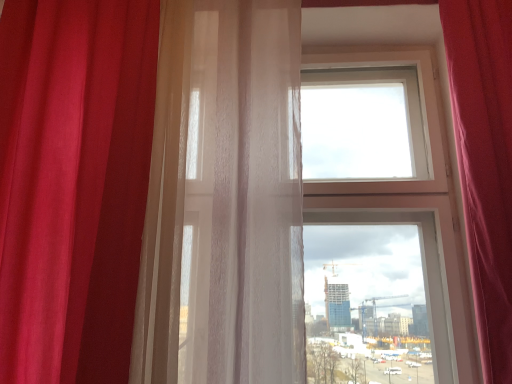
This screenshot has height=384, width=512. What do you see at coordinates (485, 163) in the screenshot? I see `velvet red curtain at right, the third curtain in the left-to-right sequence` at bounding box center [485, 163].

The height and width of the screenshot is (384, 512). I want to click on satin red curtain at left, marked as the first curtain in a left-to-right arrangement, so click(73, 184).

Image resolution: width=512 pixels, height=384 pixels. I want to click on translucent white curtain at left, which ranks as the second curtain in right-to-left order, so click(225, 197).

Locate an element on the screen. The width and height of the screenshot is (512, 384). velvet red curtain at right, which is counted as the first curtain, starting from the right is located at coordinates (485, 163).

From the image's perspective, is satin red curtain at left, which ranks as the 3th curtain in right-to-left order, on top of velvet red curtain at right, which is counted as the first curtain, starting from the right?

Yes, from the image's perspective, satin red curtain at left, which ranks as the 3th curtain in right-to-left order, is on top of velvet red curtain at right, which is counted as the first curtain, starting from the right.

Which is more to the right, satin red curtain at left, marked as the first curtain in a left-to-right arrangement, or velvet red curtain at right, which is counted as the first curtain, starting from the right?

A: From the viewer's perspective, velvet red curtain at right, which is counted as the first curtain, starting from the right, appears more on the right side.

Is point (118, 315) less distant than point (484, 239)?

Yes, point (118, 315) is in front of point (484, 239).

Can you confirm if satin red curtain at left, which ranks as the 3th curtain in right-to-left order, is shorter than velvet red curtain at right, which is counted as the first curtain, starting from the right?

In fact, satin red curtain at left, which ranks as the 3th curtain in right-to-left order, may be taller than velvet red curtain at right, which is counted as the first curtain, starting from the right.

Is translucent white curtain at left, which ranks as the second curtain in right-to-left order, inside or outside of velvet red curtain at right, the third curtain in the left-to-right sequence?

translucent white curtain at left, which ranks as the second curtain in right-to-left order, is not enclosed by velvet red curtain at right, the third curtain in the left-to-right sequence.

Is translucent white curtain at left, which ranks as the second curtain in right-to-left order, facing towards velvet red curtain at right, which is counted as the first curtain, starting from the right?

No, translucent white curtain at left, which ranks as the second curtain in right-to-left order, does not turn towards velvet red curtain at right, which is counted as the first curtain, starting from the right.

Considering the relative sizes of translucent white curtain at left, which ranks as the second curtain in left-to-right order, and velvet red curtain at right, which is counted as the first curtain, starting from the right, in the image provided, is translucent white curtain at left, which ranks as the second curtain in left-to-right order, smaller than velvet red curtain at right, which is counted as the first curtain, starting from the right,?

No.

Which is correct: translucent white curtain at left, which ranks as the second curtain in right-to-left order, is inside satin red curtain at left, which ranks as the 3th curtain in right-to-left order, or outside of it?

translucent white curtain at left, which ranks as the second curtain in right-to-left order, is outside satin red curtain at left, which ranks as the 3th curtain in right-to-left order.

Is translucent white curtain at left, which ranks as the second curtain in right-to-left order, touching satin red curtain at left, which ranks as the 3th curtain in right-to-left order?

No, translucent white curtain at left, which ranks as the second curtain in right-to-left order, is not beside satin red curtain at left, which ranks as the 3th curtain in right-to-left order.

Looking at their sizes, would you say translucent white curtain at left, which ranks as the second curtain in left-to-right order, is wider or thinner than satin red curtain at left, which ranks as the 3th curtain in right-to-left order?

Clearly, translucent white curtain at left, which ranks as the second curtain in left-to-right order, has less width compared to satin red curtain at left, which ranks as the 3th curtain in right-to-left order.

Does translucent white curtain at left, which ranks as the second curtain in left-to-right order, turn towards satin red curtain at left, marked as the first curtain in a left-to-right arrangement?

No, translucent white curtain at left, which ranks as the second curtain in left-to-right order, is not oriented towards satin red curtain at left, marked as the first curtain in a left-to-right arrangement.

Is velvet red curtain at right, which is counted as the first curtain, starting from the right, taller or shorter than satin red curtain at left, which ranks as the 3th curtain in right-to-left order?

velvet red curtain at right, which is counted as the first curtain, starting from the right, is shorter than satin red curtain at left, which ranks as the 3th curtain in right-to-left order.

Is satin red curtain at left, which ranks as the 3th curtain in right-to-left order, at the back of velvet red curtain at right, which is counted as the first curtain, starting from the right?

No.

Which object is positioned more to the left, velvet red curtain at right, the third curtain in the left-to-right sequence, or satin red curtain at left, which ranks as the 3th curtain in right-to-left order?

satin red curtain at left, which ranks as the 3th curtain in right-to-left order.

Considering the relative sizes of velvet red curtain at right, the third curtain in the left-to-right sequence, and translucent white curtain at left, which ranks as the second curtain in right-to-left order, in the image provided, is velvet red curtain at right, the third curtain in the left-to-right sequence, taller than translucent white curtain at left, which ranks as the second curtain in right-to-left order,?

No.

In the scene shown: Which of these two, velvet red curtain at right, the third curtain in the left-to-right sequence, or translucent white curtain at left, which ranks as the second curtain in left-to-right order, is bigger?

translucent white curtain at left, which ranks as the second curtain in left-to-right order.

From a real-world perspective, between velvet red curtain at right, the third curtain in the left-to-right sequence, and translucent white curtain at left, which ranks as the second curtain in right-to-left order, who is vertically higher?

translucent white curtain at left, which ranks as the second curtain in right-to-left order, from a real-world perspective.

Does point (503, 134) come behind point (165, 236)?

No, (503, 134) is in front of (165, 236).

Could you measure the distance between satin red curtain at left, which ranks as the 3th curtain in right-to-left order, and translucent white curtain at left, which ranks as the second curtain in right-to-left order?

A distance of 11.73 inches exists between satin red curtain at left, which ranks as the 3th curtain in right-to-left order, and translucent white curtain at left, which ranks as the second curtain in right-to-left order.

Does satin red curtain at left, marked as the first curtain in a left-to-right arrangement, contain translucent white curtain at left, which ranks as the second curtain in right-to-left order?

That's incorrect, translucent white curtain at left, which ranks as the second curtain in right-to-left order, is not inside satin red curtain at left, marked as the first curtain in a left-to-right arrangement.

The width and height of the screenshot is (512, 384). Identify the location of the 1st curtain counting from the right side of the satin red curtain at left, which ranks as the 3th curtain in right-to-left order. (225, 197).

Starting from the velvet red curtain at right, which is counted as the first curtain, starting from the right, which curtain is the 2nd one to the left? Please provide its 2D coordinates.

[(73, 184)]

Identify the location of curtain that is the 2nd object located in front of the translucent white curtain at left, which ranks as the second curtain in right-to-left order. This screenshot has width=512, height=384. (485, 163).

Estimate the real-world distances between objects in this image. Which object is closer to satin red curtain at left, marked as the first curtain in a left-to-right arrangement, translucent white curtain at left, which ranks as the second curtain in right-to-left order, or velvet red curtain at right, which is counted as the first curtain, starting from the right?

translucent white curtain at left, which ranks as the second curtain in right-to-left order.

Based on their spatial positions, is velvet red curtain at right, which is counted as the first curtain, starting from the right, or satin red curtain at left, marked as the first curtain in a left-to-right arrangement, closer to translucent white curtain at left, which ranks as the second curtain in left-to-right order?

satin red curtain at left, marked as the first curtain in a left-to-right arrangement, is positioned closer to the anchor translucent white curtain at left, which ranks as the second curtain in left-to-right order.

Which object lies nearer to the anchor point translucent white curtain at left, which ranks as the second curtain in right-to-left order, satin red curtain at left, which ranks as the 3th curtain in right-to-left order, or velvet red curtain at right, which is counted as the first curtain, starting from the right?

satin red curtain at left, which ranks as the 3th curtain in right-to-left order.

When comparing their distances from velvet red curtain at right, which is counted as the first curtain, starting from the right, does satin red curtain at left, which ranks as the 3th curtain in right-to-left order, or translucent white curtain at left, which ranks as the second curtain in right-to-left order, seem closer?

translucent white curtain at left, which ranks as the second curtain in right-to-left order, is closer to velvet red curtain at right, which is counted as the first curtain, starting from the right.

Which object lies further to the anchor point satin red curtain at left, which ranks as the 3th curtain in right-to-left order, velvet red curtain at right, which is counted as the first curtain, starting from the right, or translucent white curtain at left, which ranks as the second curtain in left-to-right order?

Among the two, velvet red curtain at right, which is counted as the first curtain, starting from the right, is located further to satin red curtain at left, which ranks as the 3th curtain in right-to-left order.

When comparing their distances from velvet red curtain at right, the third curtain in the left-to-right sequence, does translucent white curtain at left, which ranks as the second curtain in left-to-right order, or satin red curtain at left, marked as the first curtain in a left-to-right arrangement, seem further?

The object further to velvet red curtain at right, the third curtain in the left-to-right sequence, is satin red curtain at left, marked as the first curtain in a left-to-right arrangement.

Identify the location of curtain located between satin red curtain at left, which ranks as the 3th curtain in right-to-left order, and velvet red curtain at right, the third curtain in the left-to-right sequence, in the left-right direction. The image size is (512, 384). (225, 197).